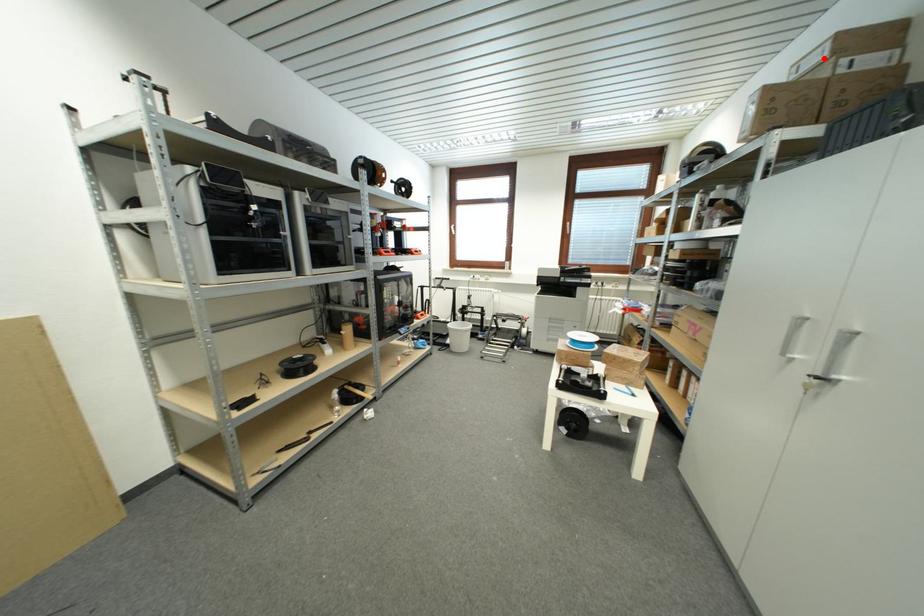
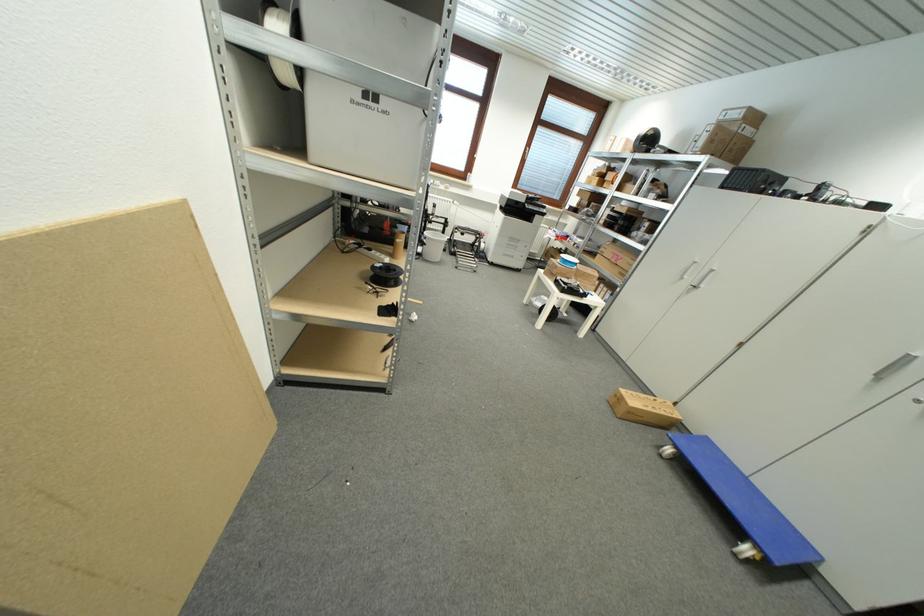
Question: I am providing you with two images of the same scene from different viewpoints. Image1 has a red point marked. In image2, the corresponding 3D location appears at what relative position? Reply with the corresponding letter.

Choices:
 (A) Closer
 (B) Farther

Answer: (A)